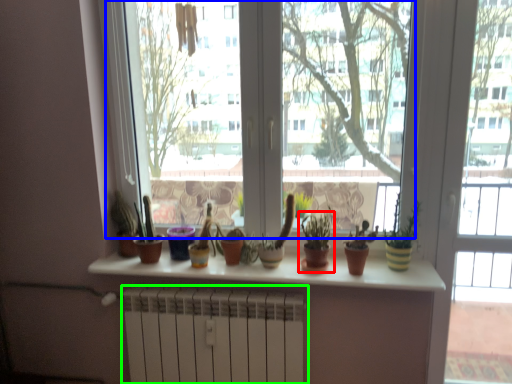
Question: Based on their relative distances, which object is farther from houseplant (highlighted by a red box)? Choose from window screen (highlighted by a blue box) and radiator (highlighted by a green box).

Choices:
 (A) window screen
 (B) radiator

Answer: (A)